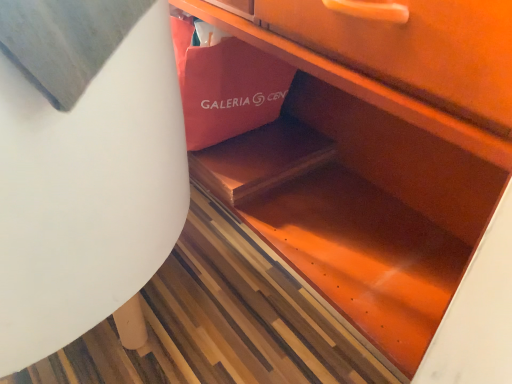
Question: Is matte pink paper bag at center taller or shorter than white matte round table at lower left?

Choices:
 (A) short
 (B) tall

Answer: (A)

Question: Is matte pink paper bag at center in front of or behind white matte round table at lower left in the image?

Choices:
 (A) front
 (B) behind

Answer: (B)

Question: Looking at their shapes, would you say matte pink paper bag at center is wider or thinner than white matte round table at lower left?

Choices:
 (A) wide
 (B) thin

Answer: (B)

Question: Considering the positions of point (69, 188) and point (270, 61), is point (69, 188) closer or farther from the camera than point (270, 61)?

Choices:
 (A) closer
 (B) farther

Answer: (A)

Question: Looking at the image, does white matte round table at lower left seem bigger or smaller compared to matte pink paper bag at center?

Choices:
 (A) big
 (B) small

Answer: (A)

Question: Which is correct: white matte round table at lower left is inside matte pink paper bag at center, or outside of it?

Choices:
 (A) outside
 (B) inside

Answer: (A)

Question: From their relative heights in the image, would you say white matte round table at lower left is taller or shorter than matte pink paper bag at center?

Choices:
 (A) short
 (B) tall

Answer: (B)